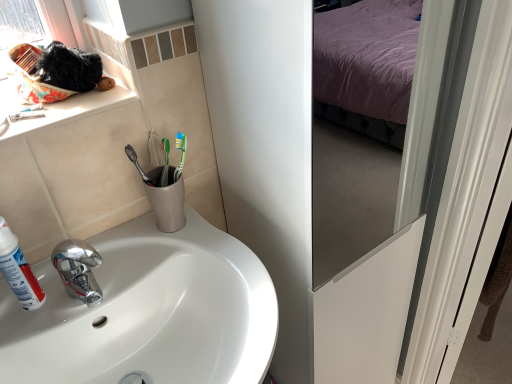
Question: Should I look upward or downward to see white glossy sink at lower left?

Choices:
 (A) up
 (B) down

Answer: (B)

Question: Can you confirm if white glossy sink at lower left is bigger than white matte shaving cream at left?

Choices:
 (A) yes
 (B) no

Answer: (A)

Question: Are white glossy sink at lower left and white matte shaving cream at left far apart?

Choices:
 (A) no
 (B) yes

Answer: (A)

Question: Does white glossy sink at lower left have a lesser height compared to white matte shaving cream at left?

Choices:
 (A) no
 (B) yes

Answer: (A)

Question: Is white glossy sink at lower left positioned beyond the bounds of white matte shaving cream at left?

Choices:
 (A) yes
 (B) no

Answer: (A)

Question: From the image's perspective, is white glossy sink at lower left beneath white matte shaving cream at left?

Choices:
 (A) yes
 (B) no

Answer: (A)

Question: Can you confirm if white glossy sink at lower left is smaller than white matte shaving cream at left?

Choices:
 (A) no
 (B) yes

Answer: (A)

Question: Is white matte shaving cream at left to the right of white glossy sink at lower left from the viewer's perspective?

Choices:
 (A) yes
 (B) no

Answer: (B)

Question: Does white matte shaving cream at left have a lesser height compared to white glossy sink at lower left?

Choices:
 (A) yes
 (B) no

Answer: (A)

Question: Are white matte shaving cream at left and white glossy sink at lower left making contact?

Choices:
 (A) no
 (B) yes

Answer: (A)

Question: Is white matte shaving cream at left turned away from white glossy sink at lower left?

Choices:
 (A) yes
 (B) no

Answer: (B)

Question: Considering the relative sizes of white matte shaving cream at left and white glossy sink at lower left in the image provided, is white matte shaving cream at left bigger than white glossy sink at lower left?

Choices:
 (A) yes
 (B) no

Answer: (B)

Question: Does white matte shaving cream at left have a greater width compared to white glossy sink at lower left?

Choices:
 (A) yes
 (B) no

Answer: (B)

Question: Relative to white glossy sink at lower left, is white matte shaving cream at left in front or behind?

Choices:
 (A) behind
 (B) front

Answer: (A)